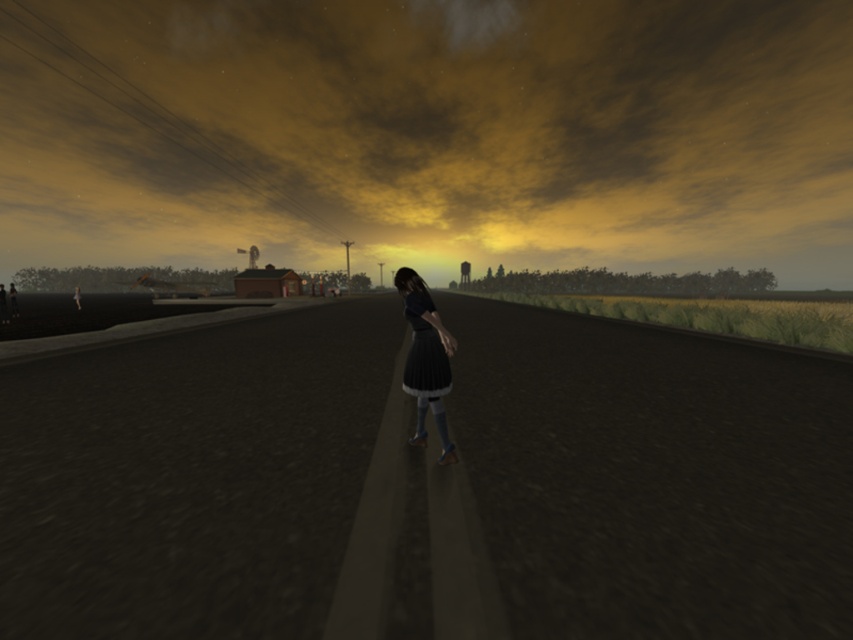
Based on the photo, you are standing on the road in the twilight scene and notice the cloudy sky at upper center and the matte black dress at center. Which object appears bigger to you?

The cloudy sky at upper center appears larger than the matte black dress at center because it has a larger size compared to the dress.

In the scene shown: You are standing at the center of the scene and see the black asphalt train track at center and the matte black dress at center. Which object is closer to you?

The matte black dress at center is closer to you than the black asphalt train track at center because the distance between them is 7.58 meters, meaning the dress is nearer.

You are a photographer planning to capture the entire scene in one shot. Given that the black asphalt train track at center and the cloudy sky at upper center are both in view, which object would appear smaller in your photo?

The black asphalt train track at center would appear smaller than the cloudy sky at upper center in the photo.